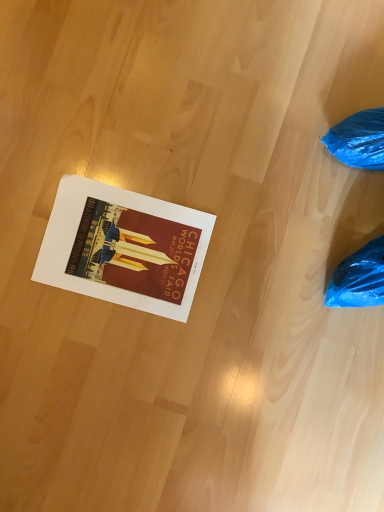
Find the location of a particular element. free space above matte paper poster at center (from a real-world perspective) is located at coordinates [120, 249].